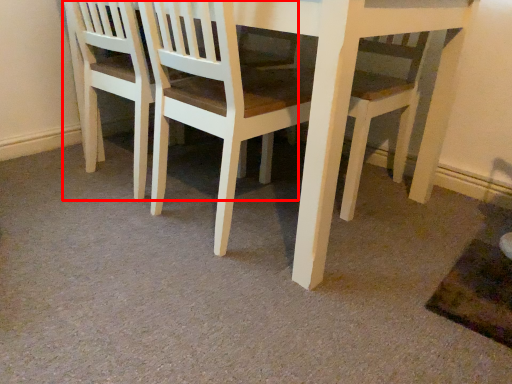
Question: From the image's perspective, where is chair (annotated by the red box) located relative to chair?

Choices:
 (A) below
 (B) above

Answer: (B)